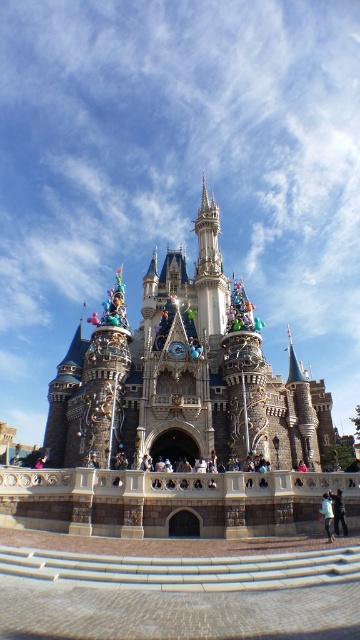
Can you confirm if stone castle at center is positioned to the left of light blue denim jeans at lower right?

Yes, stone castle at center is to the left of light blue denim jeans at lower right.

From the picture: Who is more distant from viewer, (286, 452) or (342, 508)?

The point (286, 452) is behind.

At what (x,y) coordinates should I click in order to perform the action: click on stone castle at center. Please return your answer as a coordinate pair (x, y). Looking at the image, I should click on coord(182,376).

This screenshot has height=640, width=360. I want to click on light blue denim jeans at lower right, so click(339, 513).

Between point (343, 508) and point (326, 506), which one is positioned in front?

Point (326, 506) is in front.

I want to click on light blue denim jeans at lower right, so click(339, 513).

Is stone castle at center to the left of light blue denim jacket at lower right from the viewer's perspective?

Indeed, stone castle at center is positioned on the left side of light blue denim jacket at lower right.

Can you confirm if stone castle at center is bigger than light blue denim jacket at lower right?

Yes, stone castle at center is bigger than light blue denim jacket at lower right.

Is point (198, 436) farther from viewer compared to point (326, 513)?

That is True.

Locate an element on the screen. This screenshot has width=360, height=640. stone castle at center is located at coordinates (182, 376).